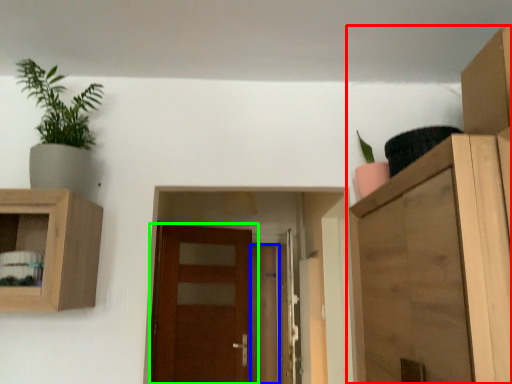
Question: Which object is positioned closest to cupboard (highlighted by a red box)? Select from door (highlighted by a blue box) and door (highlighted by a green box).

Choices:
 (A) door
 (B) door

Answer: (B)